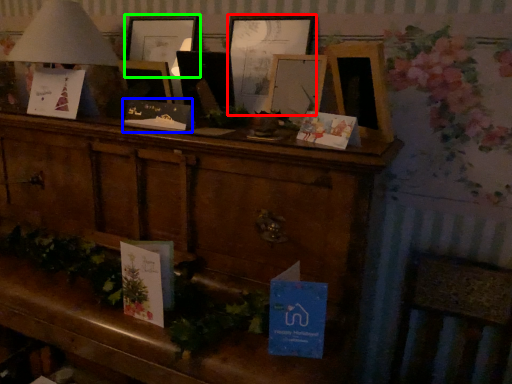
Question: Which object is positioned farthest from picture frame (highlighted by a red box)? Select from christmas card (highlighted by a blue box) and picture frame (highlighted by a green box).

Choices:
 (A) christmas card
 (B) picture frame

Answer: (A)